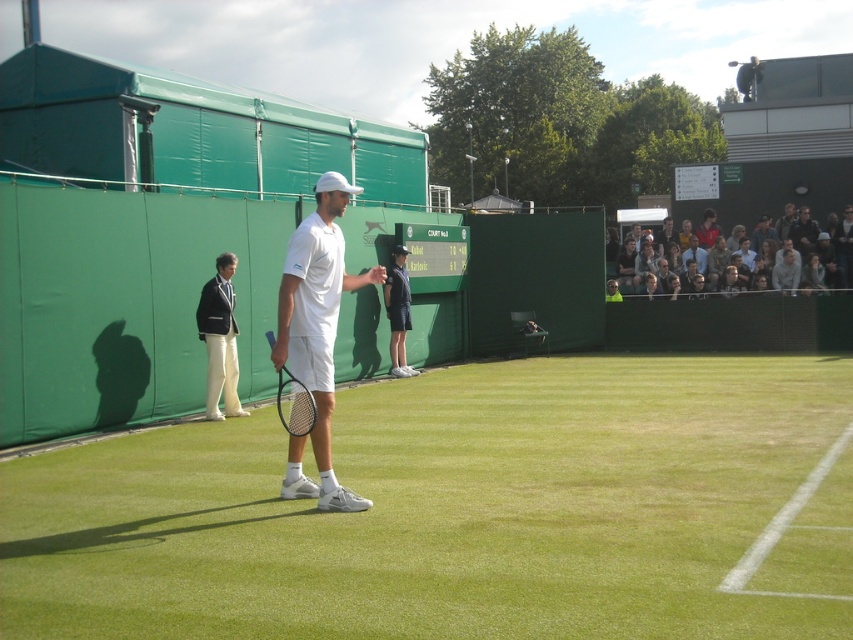
Who is shorter, white matte tennis racket at center or dark blue shirt at upper right?

dark blue shirt at upper right is shorter.

Does white matte tennis racket at center lie behind dark blue shirt at upper right?

That is False.

Which is behind, point (300, 348) or point (780, 218)?

The point (780, 218) is more distant.

Locate an element on the screen. Image resolution: width=853 pixels, height=640 pixels. white matte tennis racket at center is located at coordinates (316, 333).

Between green grass tennis court at center and light brown leather jacket at upper right, which one appears on the left side from the viewer's perspective?

Positioned to the left is green grass tennis court at center.

Can you confirm if green grass tennis court at center is positioned above light brown leather jacket at upper right?

Incorrect, green grass tennis court at center is not positioned above light brown leather jacket at upper right.

Identify the location of green grass tennis court at center. (440, 509).

Locate an element on the screen. green grass tennis court at center is located at coordinates (440, 509).

Who is more distant from viewer, (822, 433) or (663, 241)?

The point (663, 241) is more distant.

Between green grass tennis court at center and white cotton shirt at center, which one is positioned higher?

white cotton shirt at center is higher up.

Does point (178, 468) come farther from viewer compared to point (666, 243)?

No, (178, 468) is closer to viewer.

This screenshot has width=853, height=640. In order to click on green grass tennis court at center in this screenshot , I will do `click(440, 509)`.